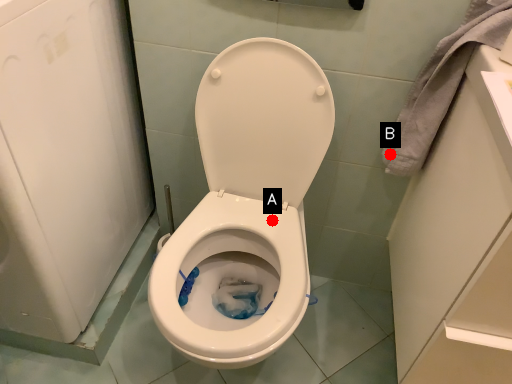
Question: Two points are circled on the image, labeled by A and B beside each circle. Which point is farther to the camera?

Choices:
 (A) A is further
 (B) B is further

Answer: (A)